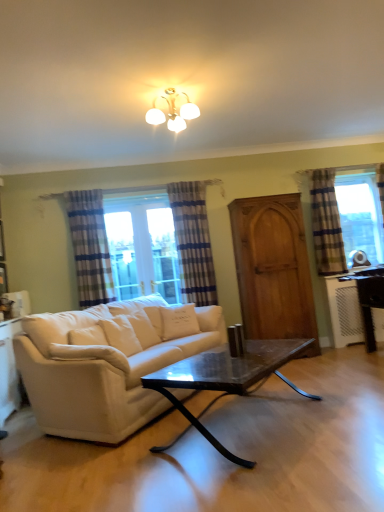
Question: In which direction should I rotate to look at white plush pillow at center, the second pillow in the right-to-left sequence?

Choices:
 (A) right
 (B) left

Answer: (B)

Question: Would you consider marble black coffee table at center to be distant from blue striped curtain at right, which appears as the third curtain when viewed from the left?

Choices:
 (A) no
 (B) yes

Answer: (B)

Question: Does marble black coffee table at center have a greater height compared to blue striped curtain at right, acting as the 1th curtain starting from the right?

Choices:
 (A) no
 (B) yes

Answer: (A)

Question: Does marble black coffee table at center have a larger size compared to blue striped curtain at right, acting as the 1th curtain starting from the right?

Choices:
 (A) no
 (B) yes

Answer: (B)

Question: From the image's perspective, is marble black coffee table at center located above blue striped curtain at right, which appears as the third curtain when viewed from the left?

Choices:
 (A) no
 (B) yes

Answer: (A)

Question: Is marble black coffee table at center closer to camera compared to blue striped curtain at right, which appears as the third curtain when viewed from the left?

Choices:
 (A) no
 (B) yes

Answer: (B)

Question: Does marble black coffee table at center have a lesser height compared to blue striped curtain at right, acting as the 1th curtain starting from the right?

Choices:
 (A) yes
 (B) no

Answer: (A)

Question: Considering the relative sizes of blue striped curtain at right, which appears as the third curtain when viewed from the left, and white glossy light fixture at upper center in the image provided, is blue striped curtain at right, which appears as the third curtain when viewed from the left, wider than white glossy light fixture at upper center?

Choices:
 (A) yes
 (B) no

Answer: (B)

Question: From the image's perspective, would you say blue striped curtain at right, acting as the 1th curtain starting from the right, is positioned over white glossy light fixture at upper center?

Choices:
 (A) yes
 (B) no

Answer: (B)

Question: Is blue striped curtain at right, which appears as the third curtain when viewed from the left, closer to the viewer compared to white glossy light fixture at upper center?

Choices:
 (A) yes
 (B) no

Answer: (B)

Question: From the image's perspective, would you say blue striped curtain at right, acting as the 1th curtain starting from the right, is shown under white glossy light fixture at upper center?

Choices:
 (A) no
 (B) yes

Answer: (B)

Question: Is blue striped curtain at right, acting as the 1th curtain starting from the right, touching white glossy light fixture at upper center?

Choices:
 (A) no
 (B) yes

Answer: (A)

Question: Is blue striped curtain at right, acting as the 1th curtain starting from the right, turned away from white glossy light fixture at upper center?

Choices:
 (A) no
 (B) yes

Answer: (A)

Question: Considering the relative sizes of white glossy light fixture at upper center and blue striped curtain at right, acting as the 1th curtain starting from the right, in the image provided, is white glossy light fixture at upper center shorter than blue striped curtain at right, acting as the 1th curtain starting from the right,?

Choices:
 (A) no
 (B) yes

Answer: (B)